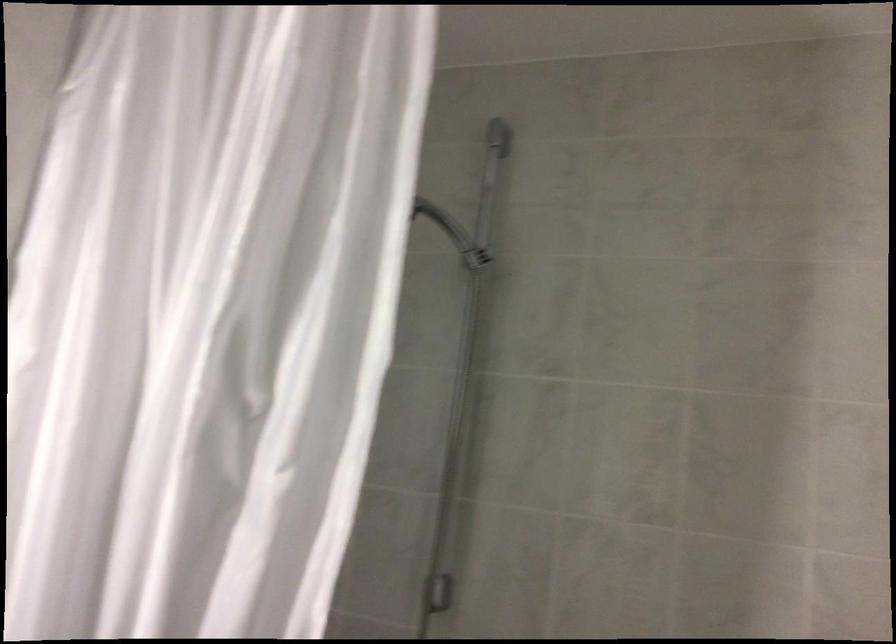
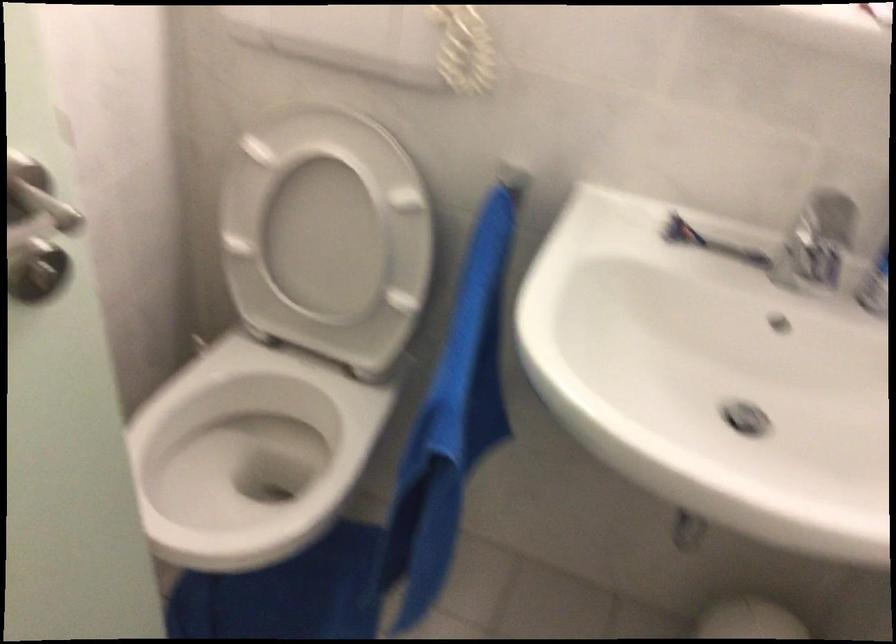
Looking at this image, based on the continuous images, in which direction is the camera rotating?

The rotation direction of the camera is left-down.